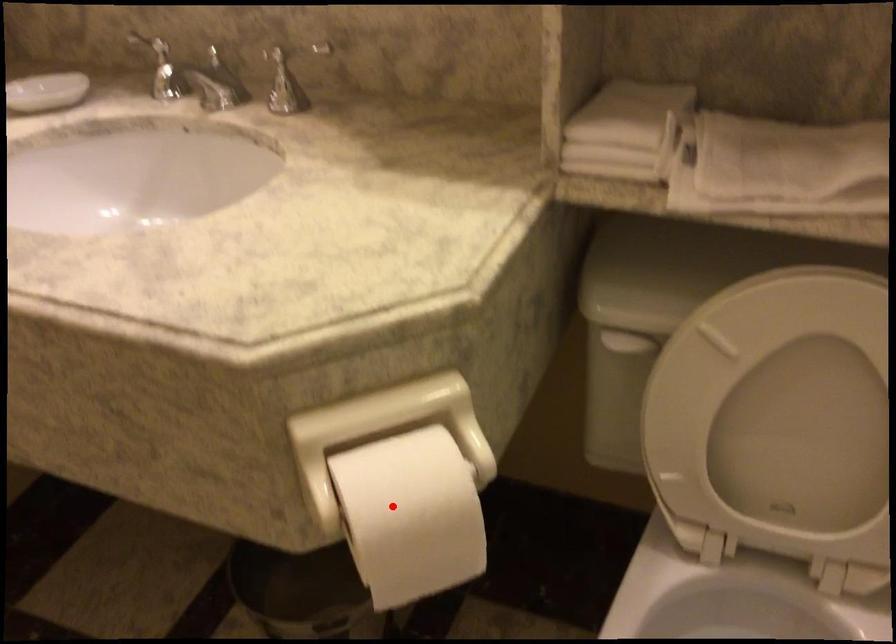
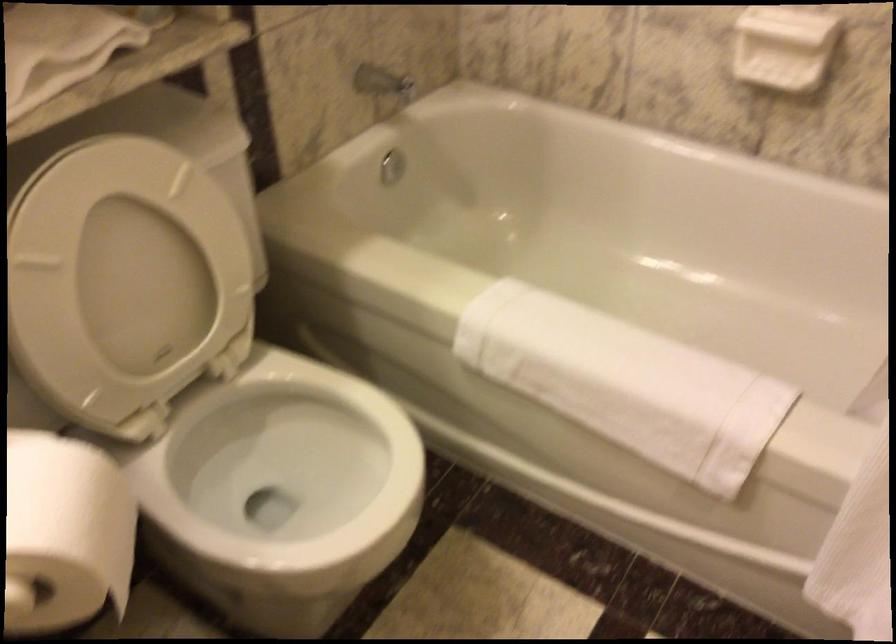
In the second image, find the point that corresponds to the highlighted location in the first image.

(64, 534)